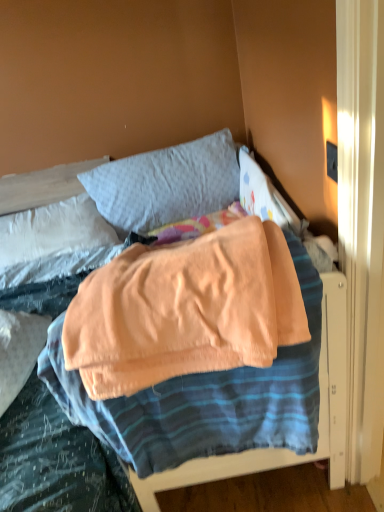
Question: From the image's perspective, is matte black outlet at upper right above or below light gray fabric pillow at upper left, the 2th pillow positioned from the right?

Choices:
 (A) below
 (B) above

Answer: (B)

Question: In terms of height, does matte black outlet at upper right look taller or shorter compared to light gray fabric pillow at upper left, the 2th pillow positioned from the right?

Choices:
 (A) tall
 (B) short

Answer: (B)

Question: Which of these objects is positioned closest to the gray cotton pillow at upper center, which is counted as the first pillow, starting from the right?

Choices:
 (A) matte black outlet at upper right
 (B) soft peach blanket at center
 (C) light gray fabric pillow at upper left, which is the 1th pillow in left-to-right order

Answer: (B)

Question: Estimate the real-world distances between objects in this image. Which object is farther from the matte black outlet at upper right?

Choices:
 (A) soft peach blanket at center
 (B) light gray fabric pillow at upper left, the 2th pillow positioned from the right
 (C) gray cotton pillow at upper center, which is counted as the first pillow, starting from the right

Answer: (B)